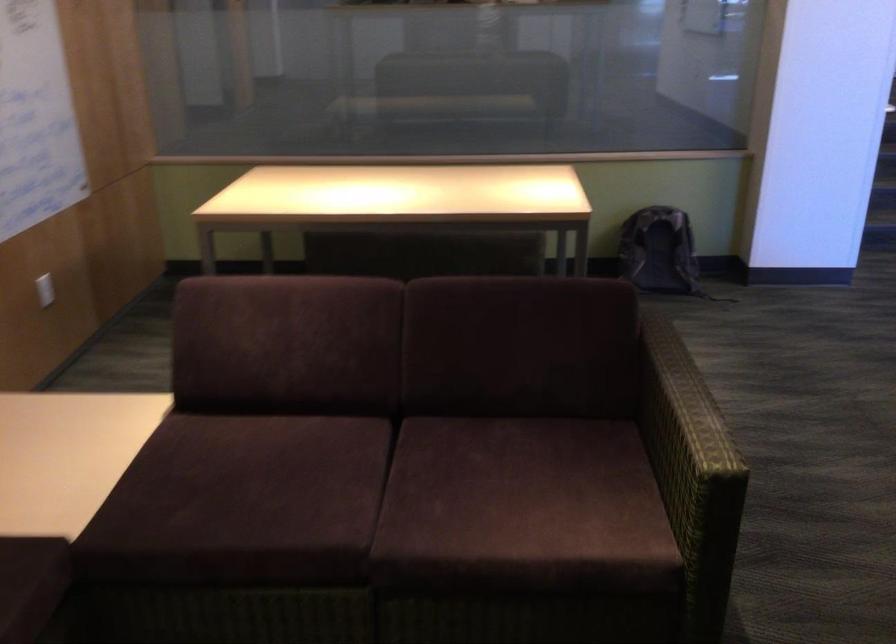
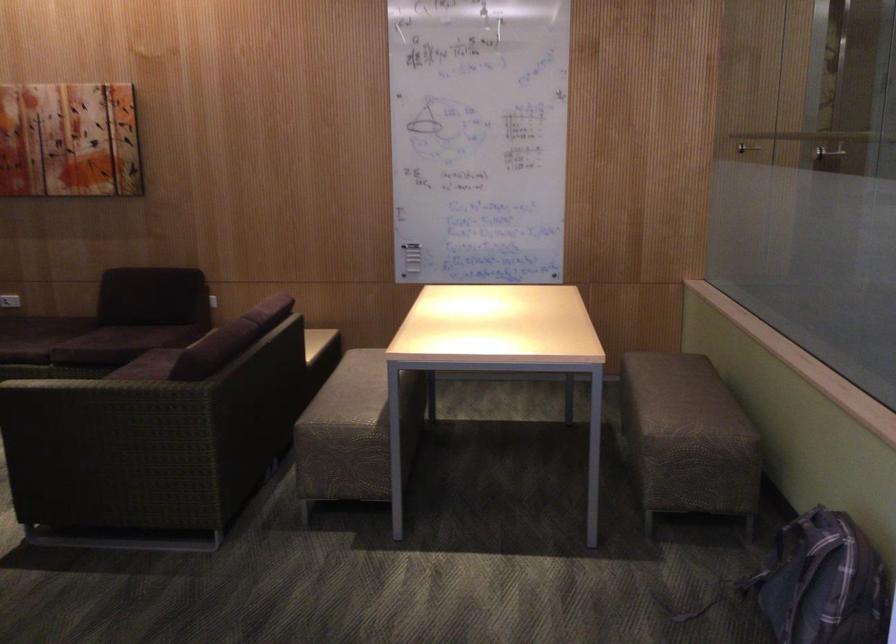
Question: I am providing you with two images of the same scene from different viewpoints. After the viewpoint changes to image2, which objects are now occluded?

Choices:
 (A) purple sofa sitting surface
 (B) silver shower handle
 (C) white power outlet
 (D) sofa armrest

Answer: (D)